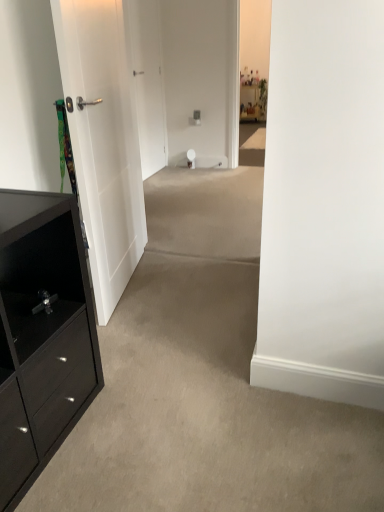
Question: Does white smooth door at center, the second door in the front-to-back sequence, appear on the left side of white matte door at left, arranged as the second door when viewed from the back?

Choices:
 (A) no
 (B) yes

Answer: (B)

Question: From the image's perspective, does white smooth door at center, which is the 1th door from back to front, appear lower than white matte door at left, arranged as the second door when viewed from the back?

Choices:
 (A) yes
 (B) no

Answer: (B)

Question: Is white smooth door at center, the second door in the front-to-back sequence, aimed at white matte door at left, arranged as the first door when viewed from the front?

Choices:
 (A) no
 (B) yes

Answer: (A)

Question: Can you confirm if white smooth door at center, the second door in the front-to-back sequence, is thinner than white matte door at left, arranged as the first door when viewed from the front?

Choices:
 (A) no
 (B) yes

Answer: (B)

Question: Is white smooth door at center, the second door in the front-to-back sequence, closer to camera compared to white matte door at left, arranged as the second door when viewed from the back?

Choices:
 (A) no
 (B) yes

Answer: (A)

Question: Is white smooth door at center, the second door in the front-to-back sequence, positioned with its back to white matte door at left, arranged as the first door when viewed from the front?

Choices:
 (A) no
 (B) yes

Answer: (A)

Question: From a real-world perspective, is black matte cabinet at left below white smooth door at center, the second door in the front-to-back sequence?

Choices:
 (A) no
 (B) yes

Answer: (B)

Question: From a real-world perspective, is black matte cabinet at left physically above white smooth door at center, which is the 1th door from back to front?

Choices:
 (A) no
 (B) yes

Answer: (A)

Question: Does black matte cabinet at left have a larger size compared to white smooth door at center, the second door in the front-to-back sequence?

Choices:
 (A) no
 (B) yes

Answer: (B)

Question: From the image's perspective, would you say black matte cabinet at left is shown under white smooth door at center, which is the 1th door from back to front?

Choices:
 (A) yes
 (B) no

Answer: (A)

Question: Is black matte cabinet at left further to the viewer compared to white smooth door at center, which is the 1th door from back to front?

Choices:
 (A) yes
 (B) no

Answer: (B)

Question: Does black matte cabinet at left have a smaller size compared to white smooth door at center, which is the 1th door from back to front?

Choices:
 (A) yes
 (B) no

Answer: (B)

Question: Can you confirm if white smooth door at center, which is the 1th door from back to front, is bigger than black matte cabinet at left?

Choices:
 (A) yes
 (B) no

Answer: (B)